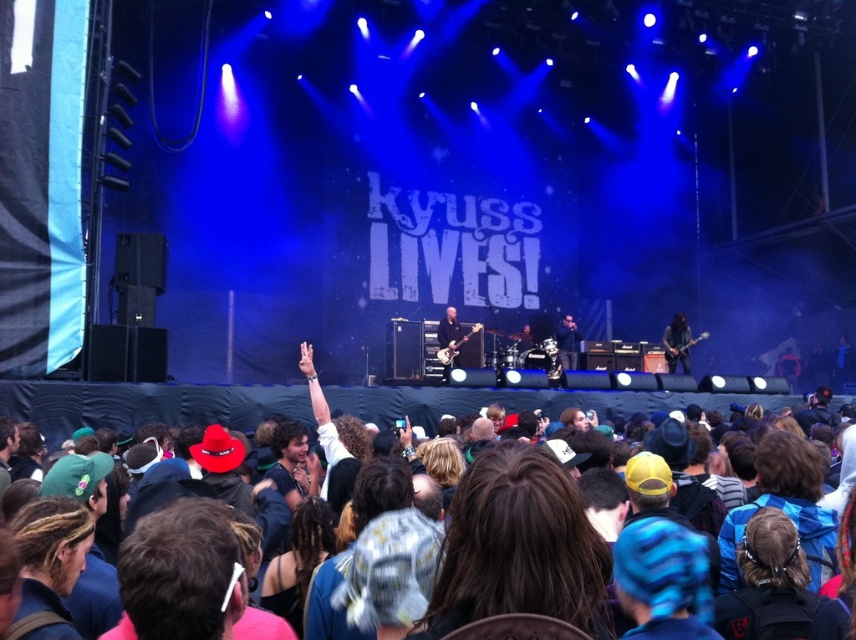
Identify the location of matte black guitar at center. This screenshot has width=856, height=640. (449, 340).

Describe the element at coordinates (449, 340) in the screenshot. Image resolution: width=856 pixels, height=640 pixels. I see `matte black guitar at center` at that location.

This screenshot has height=640, width=856. I want to click on matte black guitar at center, so click(449, 340).

Can you confirm if black matte guitar at center is taller than matte black guitar at center?

Correct, black matte guitar at center is much taller as matte black guitar at center.

The image size is (856, 640). In order to click on black matte guitar at center in this screenshot , I will do pyautogui.click(x=676, y=342).

Where is `black matte guitar at center`? The width and height of the screenshot is (856, 640). black matte guitar at center is located at coordinates (676, 342).

Is black matte guitar at center positioned at the back of black leather jacket at center?

No.

Is black matte guitar at center shorter than black leather jacket at center?

No.

Does point (681, 364) lie behind point (571, 323)?

No.

Identify the location of black matte guitar at center. (676, 342).